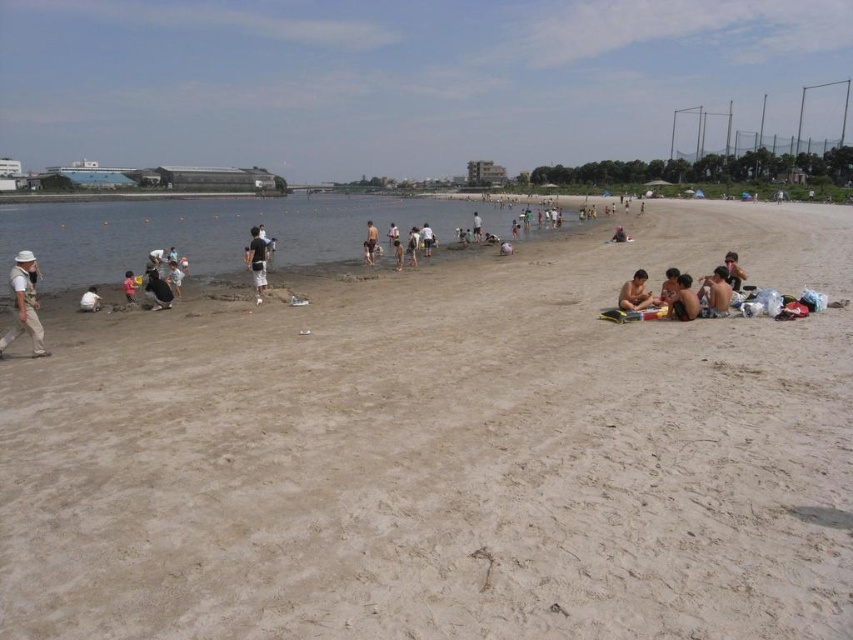
You are a swimmer standing on the beach and see the clear water at center and the white cotton shorts at center. Which object is higher in the scene?

The clear water at center is taller than the white cotton shorts at center.

You are standing on the light brown sand at center and want to reach the clear water at center. According to the scene description, which direction should you move towards?

The light brown sand at center is located below clear water at center, so you should move upward to reach the clear water at center.